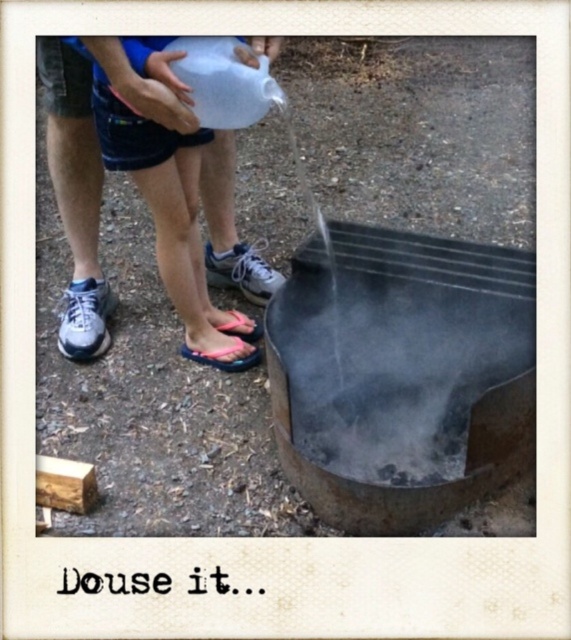
Question: Is rusty metal fire pit at lower center positioned before blue denim shorts at left?

Choices:
 (A) no
 (B) yes

Answer: (B)

Question: Is rusty metal fire pit at lower center above blue denim shorts at left?

Choices:
 (A) yes
 (B) no

Answer: (B)

Question: Which point appears farthest from the camera in this image?

Choices:
 (A) (371, 353)
 (B) (191, 202)

Answer: (A)

Question: In this image, where is rusty metal fire pit at lower center located relative to blue denim shorts at left?

Choices:
 (A) above
 (B) below

Answer: (B)

Question: Among these points, which one is nearest to the camera?

Choices:
 (A) (455, 333)
 (B) (66, 154)

Answer: (A)

Question: Among these points, which one is farthest from the camera?

Choices:
 (A) (460, 490)
 (B) (122, 44)

Answer: (A)